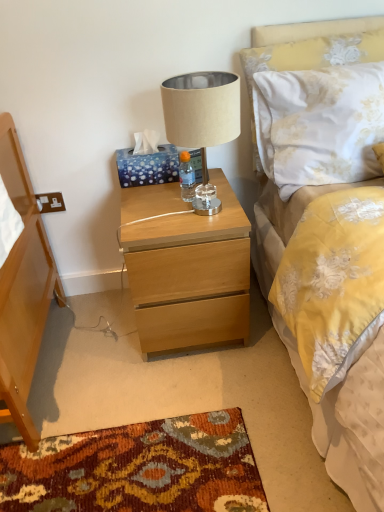
What are the coordinates of `vacant space to the left of beige fabric lampshade at center` in the screenshot? It's located at (148, 211).